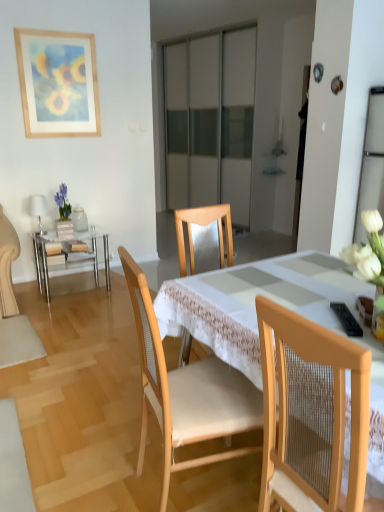
Where is `vacant space to the left of wooden chair at center, acting as the 1th chair starting from the left`? This screenshot has height=512, width=384. vacant space to the left of wooden chair at center, acting as the 1th chair starting from the left is located at coordinates (97, 463).